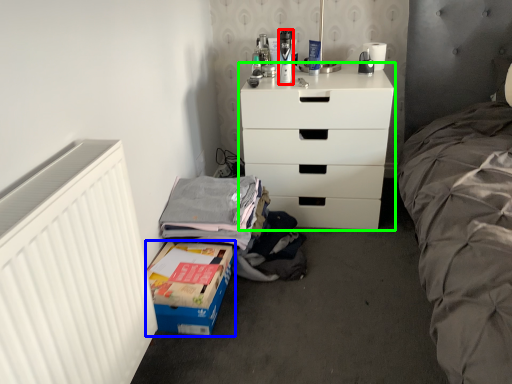
Question: Which is farther away from toiletry (highlighted by a red box)? box (highlighted by a blue box) or chest of drawers (highlighted by a green box)?

Choices:
 (A) box
 (B) chest of drawers

Answer: (A)